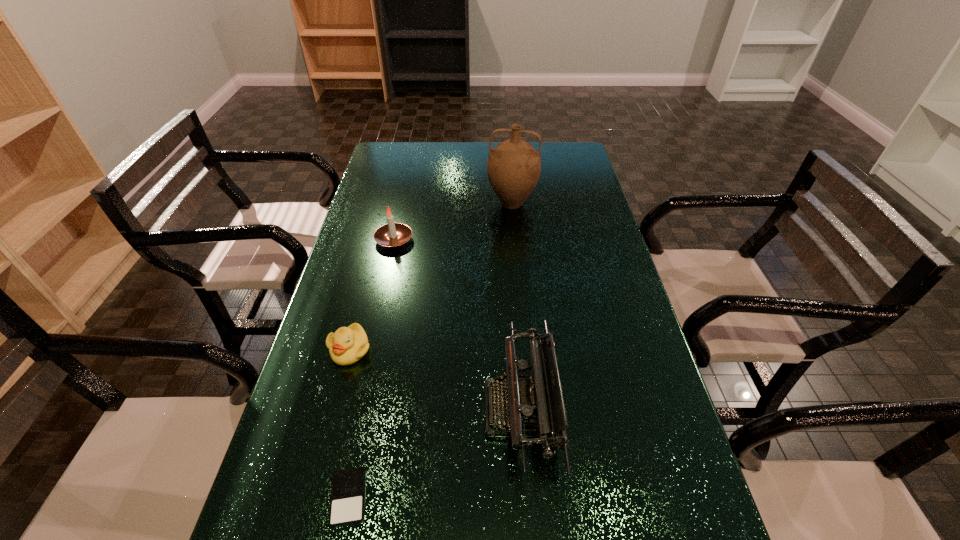
Identify the location of object identified as the fourth closest to the candle. This screenshot has height=540, width=960. (347, 501).

This screenshot has width=960, height=540. Find the location of `blank area in the image that satisfies the following two spatial constraints: 1. on the front side of the shortest object; 2. on the right side of the second farthest object`. blank area in the image that satisfies the following two spatial constraints: 1. on the front side of the shortest object; 2. on the right side of the second farthest object is located at coordinates (337, 497).

Where is `vacant space that satisfies the following two spatial constraints: 1. at the face of the shortest object; 2. on the left side of the second shortest object`? Image resolution: width=960 pixels, height=540 pixels. vacant space that satisfies the following two spatial constraints: 1. at the face of the shortest object; 2. on the left side of the second shortest object is located at coordinates (311, 497).

This screenshot has height=540, width=960. I want to click on vacant region that satisfies the following two spatial constraints: 1. on the back side of the farthest object; 2. on the left side of the shortest object, so click(x=408, y=203).

Identify the location of free spot that satisfies the following two spatial constraints: 1. at the face of the fourth tallest object; 2. on the right side of the shortest object. The height and width of the screenshot is (540, 960). (311, 497).